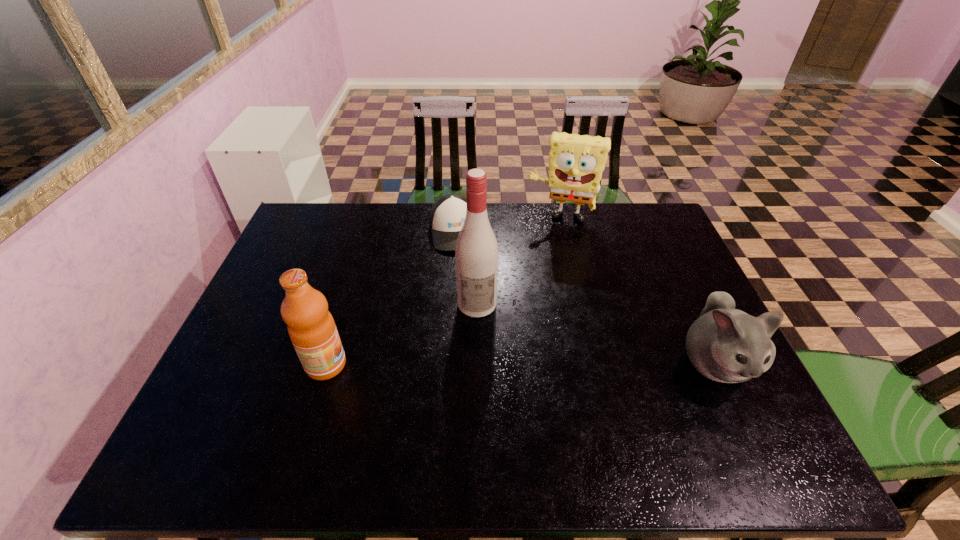
Find the location of a particular element. Image resolution: width=960 pixels, height=540 pixels. vacant space on the desktop that is between the fruit juice and the second shortest object and is positioned on the face of the sponge is located at coordinates (531, 363).

Where is `vacant spot on the desktop that is between the leftmost object and the hamster and is positioned on the front panel of the shortest object`? The height and width of the screenshot is (540, 960). vacant spot on the desktop that is between the leftmost object and the hamster and is positioned on the front panel of the shortest object is located at coordinates (484, 364).

Locate an element on the screen. vacant space on the desktop that is between the fruit juice and the rightmost object and is positioned on the label of the alcohol is located at coordinates (481, 364).